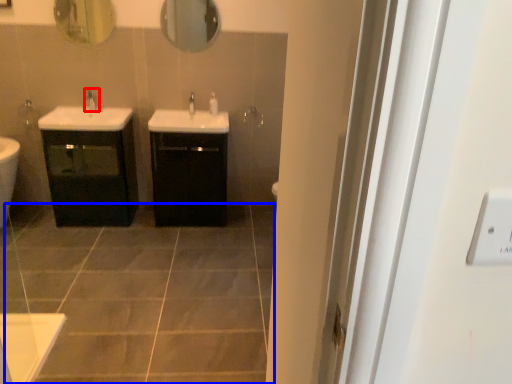
Question: Which point is closer to the camera, tap (highlighted by a red box) or ceramic tile (highlighted by a blue box)?

Choices:
 (A) tap
 (B) ceramic tile

Answer: (B)